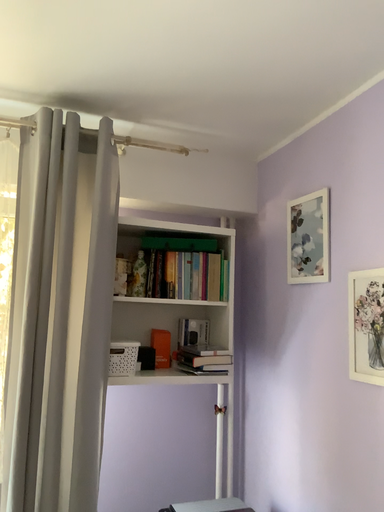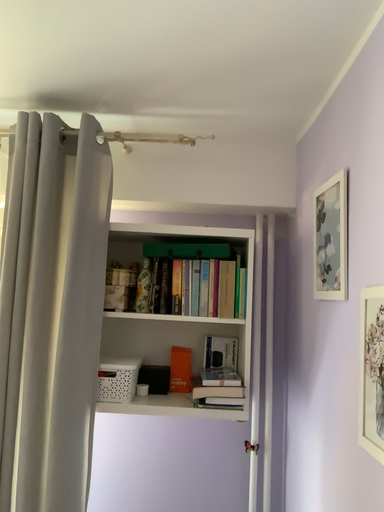
Question: How did the camera likely rotate when shooting the video?

Choices:
 (A) rotated right
 (B) rotated left

Answer: (B)